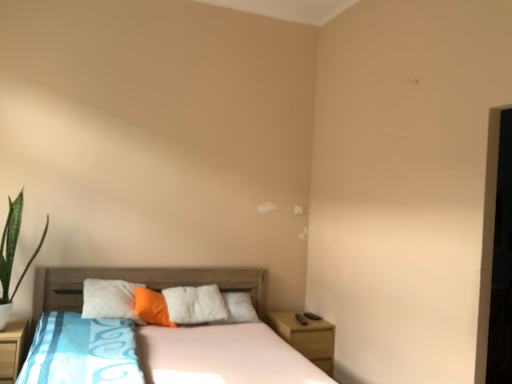
Question: From the image's perspective, is orange soft pillow at center on wooden nightstand at lower left, the 2th nightstand in the back-to-front sequence?

Choices:
 (A) yes
 (B) no

Answer: (A)

Question: Is orange soft pillow at center to the right of wooden nightstand at lower left, which is the 2th nightstand from right to left, from the viewer's perspective?

Choices:
 (A) yes
 (B) no

Answer: (A)

Question: Is orange soft pillow at center outside of wooden nightstand at lower left, the first nightstand positioned from the left?

Choices:
 (A) no
 (B) yes

Answer: (B)

Question: Is the depth of orange soft pillow at center less than that of wooden nightstand at lower left, which is the 2th nightstand from right to left?

Choices:
 (A) yes
 (B) no

Answer: (B)

Question: Does orange soft pillow at center have a greater width compared to wooden nightstand at lower left, the first nightstand positioned from the left?

Choices:
 (A) yes
 (B) no

Answer: (B)

Question: Is orange soft pillow at center further to the viewer compared to wooden nightstand at lower left, which is the 2th nightstand from right to left?

Choices:
 (A) yes
 (B) no

Answer: (A)

Question: Is orange soft pillow at center closer to the viewer compared to wooden bed at center?

Choices:
 (A) no
 (B) yes

Answer: (A)

Question: Is orange soft pillow at center facing towards wooden bed at center?

Choices:
 (A) no
 (B) yes

Answer: (B)

Question: Would you consider orange soft pillow at center to be distant from wooden bed at center?

Choices:
 (A) no
 (B) yes

Answer: (A)

Question: Is orange soft pillow at center bigger than wooden bed at center?

Choices:
 (A) yes
 (B) no

Answer: (B)

Question: Is orange soft pillow at center thinner than wooden bed at center?

Choices:
 (A) no
 (B) yes

Answer: (B)

Question: Is orange soft pillow at center taller than wooden bed at center?

Choices:
 (A) no
 (B) yes

Answer: (A)

Question: From a real-world perspective, is wooden bed at center located beneath green leafy plant at left?

Choices:
 (A) yes
 (B) no

Answer: (A)